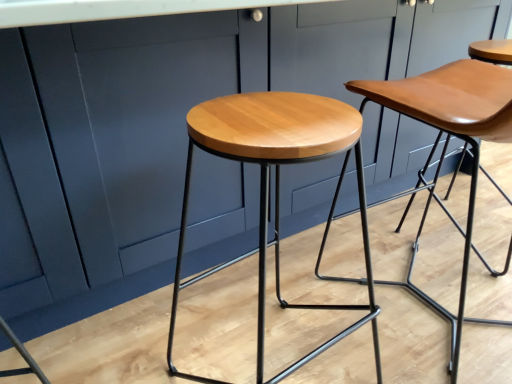
Question: Is shiny wood stool at center, which is counted as the second stool, starting from the right, oriented towards matte wood stool at center, positioned as the 2th stool in left-to-right order?

Choices:
 (A) no
 (B) yes

Answer: (A)

Question: From a real-world perspective, is shiny wood stool at center, the 1th stool in the left-to-right sequence, positioned over matte wood stool at center, which ranks as the first stool in right-to-left order, based on gravity?

Choices:
 (A) no
 (B) yes

Answer: (A)

Question: From the image's perspective, is shiny wood stool at center, the 1th stool in the left-to-right sequence, located beneath matte wood stool at center, which ranks as the first stool in right-to-left order?

Choices:
 (A) no
 (B) yes

Answer: (B)

Question: Does shiny wood stool at center, the 1th stool in the left-to-right sequence, have a smaller size compared to matte wood stool at center, positioned as the 2th stool in left-to-right order?

Choices:
 (A) yes
 (B) no

Answer: (A)

Question: Would you say shiny wood stool at center, the 1th stool in the left-to-right sequence, is a long distance from matte wood stool at center, which ranks as the first stool in right-to-left order?

Choices:
 (A) no
 (B) yes

Answer: (A)

Question: Is shiny wood stool at center, which is counted as the second stool, starting from the right, next to matte wood stool at center, positioned as the 2th stool in left-to-right order, and touching it?

Choices:
 (A) yes
 (B) no

Answer: (B)

Question: From a real-world perspective, is matte wood stool at center, which ranks as the first stool in right-to-left order, positioned over shiny wood stool at center, which is counted as the second stool, starting from the right, based on gravity?

Choices:
 (A) no
 (B) yes

Answer: (B)

Question: From the image's perspective, would you say matte wood stool at center, positioned as the 2th stool in left-to-right order, is shown under shiny wood stool at center, which is counted as the second stool, starting from the right?

Choices:
 (A) yes
 (B) no

Answer: (B)

Question: Does matte wood stool at center, positioned as the 2th stool in left-to-right order, have a lesser width compared to shiny wood stool at center, which is counted as the second stool, starting from the right?

Choices:
 (A) yes
 (B) no

Answer: (B)

Question: From the image's perspective, is matte wood stool at center, positioned as the 2th stool in left-to-right order, on shiny wood stool at center, which is counted as the second stool, starting from the right?

Choices:
 (A) no
 (B) yes

Answer: (B)

Question: Does matte wood stool at center, which ranks as the first stool in right-to-left order, have a greater width compared to shiny wood stool at center, which is counted as the second stool, starting from the right?

Choices:
 (A) yes
 (B) no

Answer: (A)

Question: Can you confirm if matte wood stool at center, which ranks as the first stool in right-to-left order, is shorter than shiny wood stool at center, the 1th stool in the left-to-right sequence?

Choices:
 (A) yes
 (B) no

Answer: (B)

Question: Looking at their shapes, would you say shiny wood stool at center, the 1th stool in the left-to-right sequence, is wider or thinner than matte wood stool at center, which ranks as the first stool in right-to-left order?

Choices:
 (A) thin
 (B) wide

Answer: (A)